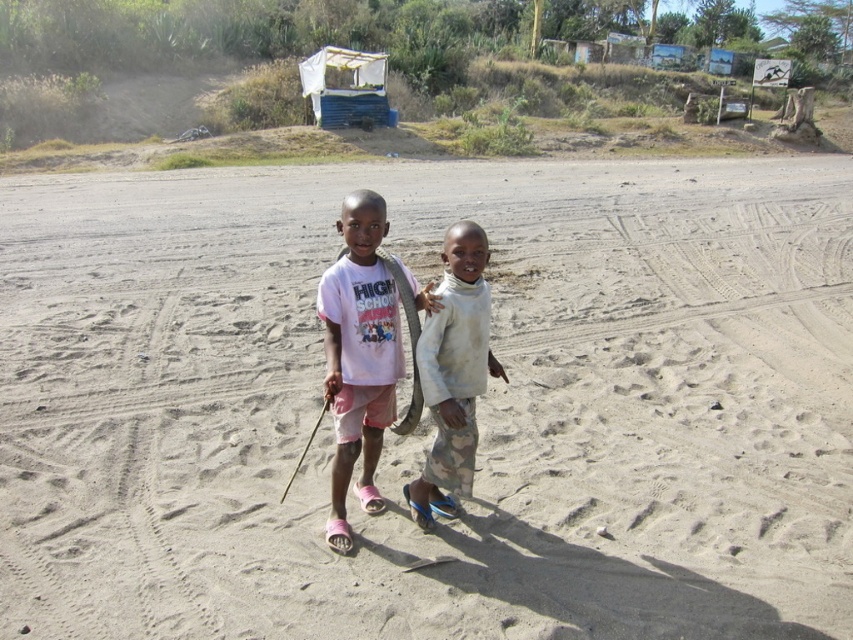
Does white matte pants at center have a larger size compared to smooth wooden stick at center?

Yes.

Is point (473, 358) farther from camera compared to point (318, 422)?

That is False.

Find the location of a particular element. The image size is (853, 640). white matte pants at center is located at coordinates (453, 372).

Between white matte t-shirt at center and smooth wooden stick at center, which one is positioned higher?

Positioned higher is white matte t-shirt at center.

Does white matte t-shirt at center appear under smooth wooden stick at center?

Incorrect, white matte t-shirt at center is not positioned below smooth wooden stick at center.

Is point (337, 538) positioned after point (323, 401)?

No, (337, 538) is closer to viewer.

What are the coordinates of `white matte t-shirt at center` in the screenshot? It's located at (358, 355).

Can you confirm if white matte t-shirt at center is positioned below white matte pants at center?

Yes.

Who is lower down, white matte t-shirt at center or white matte pants at center?

white matte t-shirt at center

I want to click on white matte t-shirt at center, so click(358, 355).

Locate an element on the screen. The image size is (853, 640). white matte t-shirt at center is located at coordinates (358, 355).